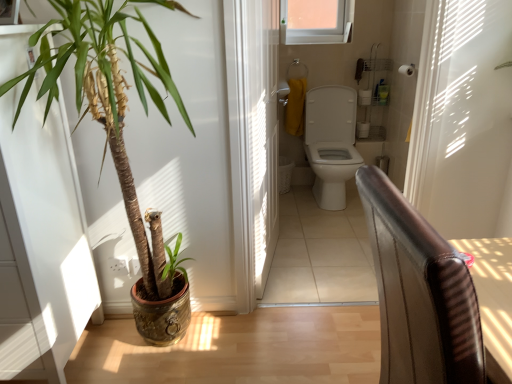
Question: Is wooden floor at lower left, which ranks as the second path in back-to-front order, located outside white glossy toilet at center, acting as the first path starting from the back?

Choices:
 (A) no
 (B) yes

Answer: (B)

Question: Is wooden floor at lower left, the second path positioned from the top, touching white glossy toilet at center, the 1th path positioned from the top?

Choices:
 (A) no
 (B) yes

Answer: (A)

Question: Is wooden floor at lower left, marked as the 1th path in a bottom-to-top arrangement, at the right side of white glossy toilet at center, acting as the first path starting from the back?

Choices:
 (A) yes
 (B) no

Answer: (B)

Question: From a real-world perspective, is wooden floor at lower left, which ranks as the second path in back-to-front order, located higher than white glossy toilet at center, the 2th path positioned from the bottom?

Choices:
 (A) yes
 (B) no

Answer: (A)

Question: Is wooden floor at lower left, the second path positioned from the top, shorter than white glossy toilet at center, acting as the first path starting from the back?

Choices:
 (A) yes
 (B) no

Answer: (B)

Question: From a real-world perspective, is transparent glass window at upper center physically located above or below translucent plastic screen door at center?

Choices:
 (A) above
 (B) below

Answer: (A)

Question: Based on their sizes in the image, would you say transparent glass window at upper center is bigger or smaller than translucent plastic screen door at center?

Choices:
 (A) small
 (B) big

Answer: (A)

Question: Visually, is transparent glass window at upper center positioned to the left or to the right of translucent plastic screen door at center?

Choices:
 (A) right
 (B) left

Answer: (A)

Question: Do you think transparent glass window at upper center is within translucent plastic screen door at center, or outside of it?

Choices:
 (A) inside
 (B) outside

Answer: (B)

Question: From a real-world perspective, is white glossy toilet at center physically located above or below white glossy toilet at center, acting as the first path starting from the back?

Choices:
 (A) below
 (B) above

Answer: (B)

Question: Is white glossy toilet at center to the left or to the right of white glossy toilet at center, the 1th path positioned from the top, in the image?

Choices:
 (A) left
 (B) right

Answer: (B)

Question: Considering the positions of point (338, 163) and point (340, 279), is point (338, 163) closer or farther from the camera than point (340, 279)?

Choices:
 (A) farther
 (B) closer

Answer: (A)

Question: Would you say white glossy toilet at center is inside or outside white glossy toilet at center, the 1th path positioned from the top?

Choices:
 (A) outside
 (B) inside

Answer: (A)

Question: Considering the positions of wooden floor at lower left, which ranks as the second path in back-to-front order, and green leafy plant at left in the image, is wooden floor at lower left, which ranks as the second path in back-to-front order, bigger or smaller than green leafy plant at left?

Choices:
 (A) small
 (B) big

Answer: (A)

Question: From a real-world perspective, is wooden floor at lower left, marked as the 1th path in a bottom-to-top arrangement, positioned above or below green leafy plant at left?

Choices:
 (A) above
 (B) below

Answer: (B)